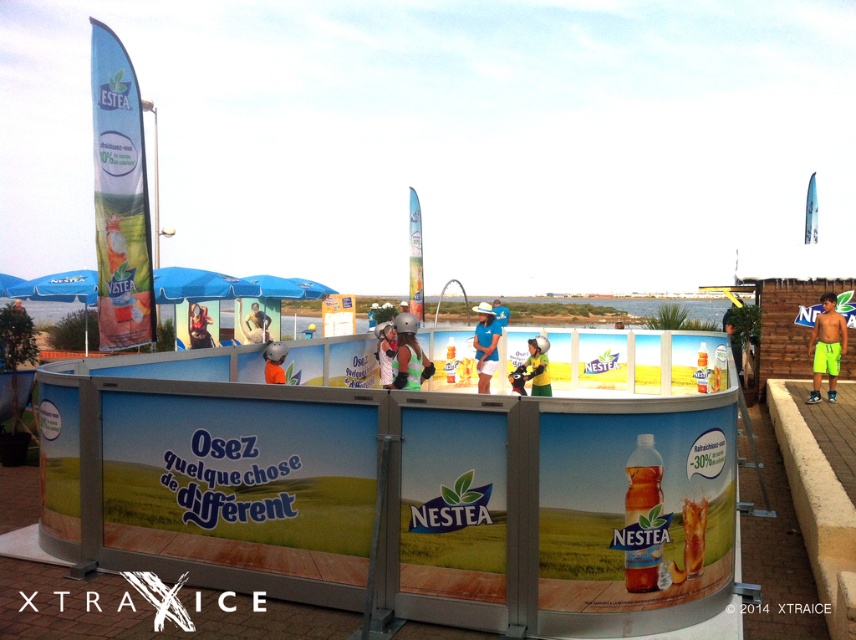
Question: Which point is closer to the camera taking this photo?

Choices:
 (A) (259, 326)
 (B) (831, 372)

Answer: (B)

Question: Can you confirm if metallic helmet at center is positioned to the left of matte white helmet at center?

Choices:
 (A) no
 (B) yes

Answer: (A)

Question: Observing the image, what is the correct spatial positioning of matte black helmet at center in reference to matte yellow helmet at center?

Choices:
 (A) left
 (B) right

Answer: (A)

Question: Among these points, which one is farthest from the camera?

Choices:
 (A) (271, 362)
 (B) (503, 324)
 (C) (839, 355)
 (D) (379, 365)

Answer: (B)

Question: Which of these objects is positioned farthest from the metallic helmet at center?

Choices:
 (A) orange fabric helmet at center
 (B) matte black helmet at center
 (C) blue fabric helmet at center

Answer: (B)

Question: Can you confirm if metallic helmet at center is smaller than matte yellow helmet at center?

Choices:
 (A) yes
 (B) no

Answer: (A)